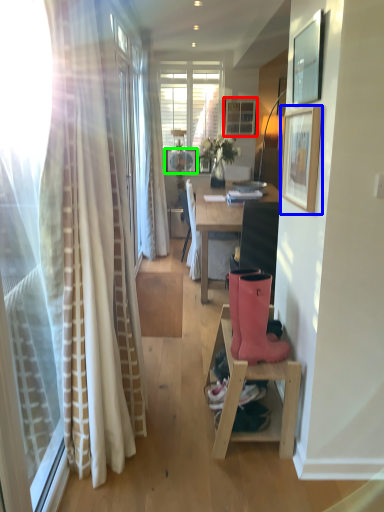
Question: Which object is positioned farthest from picture frame (highlighted by a red box)? Select from picture frame (highlighted by a blue box) and picture frame (highlighted by a green box).

Choices:
 (A) picture frame
 (B) picture frame

Answer: (A)